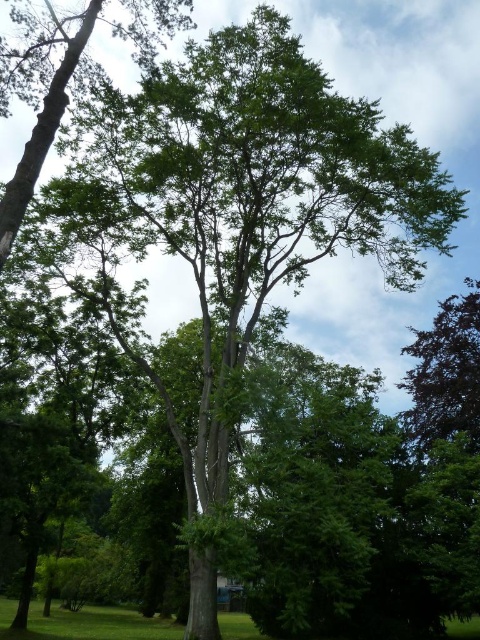
Question: Which object is closer to the camera taking this photo?

Choices:
 (A) dark green leafy tree at upper right
 (B) green leafy tree at center

Answer: (B)

Question: Does green leafy tree at center appear under dark green leafy tree at upper right?

Choices:
 (A) no
 (B) yes

Answer: (A)

Question: Is green leafy tree at center positioned in front of dark green leafy tree at upper right?

Choices:
 (A) yes
 (B) no

Answer: (A)

Question: Among these objects, which one is nearest to the camera?

Choices:
 (A) green leafy tree at center
 (B) dark green leafy tree at upper right

Answer: (A)

Question: Is green leafy tree at center smaller than dark green leafy tree at upper right?

Choices:
 (A) no
 (B) yes

Answer: (A)